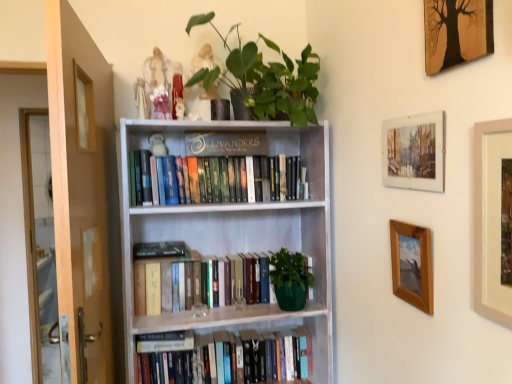
Describe the element at coordinates (490, 220) in the screenshot. I see `beige matte picture frame at upper right, the 2th picture frame from the bottom` at that location.

What do you see at coordinates (456, 32) in the screenshot? The width and height of the screenshot is (512, 384). I see `wooden framed tree art at upper right, marked as the 1th picture frame in a top-to-bottom arrangement` at bounding box center [456, 32].

The image size is (512, 384). Identify the location of watercolor paper picture frame at upper right, marked as the third picture frame in a bottom-to-top arrangement. (414, 152).

What are the coordinates of `beige matte picture frame at upper right, the 2th picture frame from the bottom` in the screenshot? It's located at (490, 220).

Between hardcover books at center, which appears as the 1th book when ordered from the bottom, and brown wooden screen door at left, which one appears on the left side from the viewer's perspective?

brown wooden screen door at left is more to the left.

Is hardcover books at center, which appears as the 1th book when ordered from the bottom, wider than brown wooden screen door at left?

Yes.

Is hardcover books at center, which appears as the 1th book when ordered from the bottom, not inside brown wooden screen door at left?

Yes, hardcover books at center, which appears as the 1th book when ordered from the bottom, is outside of brown wooden screen door at left.

Who is bigger, hardcover books at center, the third book viewed from the top, or brown wooden screen door at left?

brown wooden screen door at left is bigger.

From the image's perspective, which one is positioned higher, wooden framed tree art at upper right, marked as the 1th picture frame in a top-to-bottom arrangement, or watercolor paper picture frame at upper right, marked as the third picture frame in a bottom-to-top arrangement?

wooden framed tree art at upper right, marked as the 1th picture frame in a top-to-bottom arrangement.

Is point (457, 27) farther from camera compared to point (412, 135)?

No, it is in front of (412, 135).

Where is `the 2nd picture frame counting from the left of the wooden framed tree art at upper right, marked as the 1th picture frame in a top-to-bottom arrangement`? The image size is (512, 384). the 2nd picture frame counting from the left of the wooden framed tree art at upper right, marked as the 1th picture frame in a top-to-bottom arrangement is located at coordinates (414, 152).

Is wooden framed tree art at upper right, which is counted as the 4th picture frame, starting from the bottom, in front of or behind watercolor paper picture frame at upper right, marked as the third picture frame in a bottom-to-top arrangement, in the image?

Visually, wooden framed tree art at upper right, which is counted as the 4th picture frame, starting from the bottom, is located in front of watercolor paper picture frame at upper right, marked as the third picture frame in a bottom-to-top arrangement.

Is brown wooden screen door at left located within green matte plant at upper center?

No, brown wooden screen door at left is not a part of green matte plant at upper center.

Considering the relative sizes of green matte plant at upper center and brown wooden screen door at left in the image provided, is green matte plant at upper center wider than brown wooden screen door at left?

Correct, the width of green matte plant at upper center exceeds that of brown wooden screen door at left.

From the image's perspective, is green matte plant at upper center located above brown wooden screen door at left?

Yes.

Is point (280, 71) farther from viewer compared to point (76, 313)?

That is True.

In the scene shown: How different are the orientations of brown wooden screen door at left and wooden framed tree art at upper right, marked as the 1th picture frame in a top-to-bottom arrangement, in degrees?

brown wooden screen door at left and wooden framed tree art at upper right, marked as the 1th picture frame in a top-to-bottom arrangement, are facing 0.00462 degrees away from each other.

From the image's perspective, which is above, brown wooden screen door at left or wooden framed tree art at upper right, marked as the 1th picture frame in a top-to-bottom arrangement?

wooden framed tree art at upper right, marked as the 1th picture frame in a top-to-bottom arrangement, appears higher in the image.

From a real-world perspective, who is located lower, brown wooden screen door at left or wooden framed tree art at upper right, which is counted as the 4th picture frame, starting from the bottom?

brown wooden screen door at left is physically lower.

Considering the relative sizes of wooden picture frame at right, which is the fourth picture frame in top-to-bottom order, and hardcover books at center, marked as the 2th book in a bottom-to-top arrangement, in the image provided, is wooden picture frame at right, which is the fourth picture frame in top-to-bottom order, shorter than hardcover books at center, marked as the 2th book in a bottom-to-top arrangement,?

No.

Who is bigger, wooden picture frame at right, which ranks as the 1th picture frame in bottom-to-top order, or hardcover books at center, marked as the 2th book in a bottom-to-top arrangement?

With larger size is hardcover books at center, marked as the 2th book in a bottom-to-top arrangement.

From the picture: Which is correct: wooden picture frame at right, which is the fourth picture frame in top-to-bottom order, is inside hardcover books at center, the 2th book when ordered from top to bottom, or outside of it?

wooden picture frame at right, which is the fourth picture frame in top-to-bottom order, exists outside the volume of hardcover books at center, the 2th book when ordered from top to bottom.

Which is more to the right, wooden picture frame at right, which is the fourth picture frame in top-to-bottom order, or hardcover books at center, marked as the 2th book in a bottom-to-top arrangement?

wooden picture frame at right, which is the fourth picture frame in top-to-bottom order, is more to the right.

In the scene shown: Can you confirm if brown wooden screen door at left is shorter than green matte plant at upper center?

No, brown wooden screen door at left is not shorter than green matte plant at upper center.

Is point (62, 42) in front of point (309, 86)?

Yes, point (62, 42) is closer to viewer.

From the image's perspective, is brown wooden screen door at left positioned above or below green matte plant at upper center?

Based on their image positions, brown wooden screen door at left is located beneath green matte plant at upper center.

Is hardcover books at center, the 2th book when ordered from top to bottom, bigger or smaller than watercolor paper picture frame at upper right, the second picture frame positioned from the top?

Clearly, hardcover books at center, the 2th book when ordered from top to bottom, is larger in size than watercolor paper picture frame at upper right, the second picture frame positioned from the top.

Considering the sizes of objects hardcover books at center, the 2th book when ordered from top to bottom, and watercolor paper picture frame at upper right, marked as the third picture frame in a bottom-to-top arrangement, in the image provided, who is taller, hardcover books at center, the 2th book when ordered from top to bottom, or watercolor paper picture frame at upper right, marked as the third picture frame in a bottom-to-top arrangement,?

Standing taller between the two is watercolor paper picture frame at upper right, marked as the third picture frame in a bottom-to-top arrangement.

From a real-world perspective, which book is the 2nd one underneath the watercolor paper picture frame at upper right, marked as the third picture frame in a bottom-to-top arrangement? Please provide its 2D coordinates.

[(168, 278)]

Is hardcover books at center, the 2th book when ordered from top to bottom, at the right side of watercolor paper picture frame at upper right, marked as the third picture frame in a bottom-to-top arrangement?

Incorrect, hardcover books at center, the 2th book when ordered from top to bottom, is not on the right side of watercolor paper picture frame at upper right, marked as the third picture frame in a bottom-to-top arrangement.

Locate an element on the screen. screen door above the hardcover books at center, which appears as the 1th book when ordered from the bottom (from the image's perspective) is located at coordinates (84, 200).

There is a wooden framed tree art at upper right, marked as the 1th picture frame in a top-to-bottom arrangement. At what (x,y) coordinates should I click in order to perform the action: click on the 1st picture frame below it (from the image's perspective). Please return your answer as a coordinate pair (x, y). The image size is (512, 384). Looking at the image, I should click on (414, 152).

Considering their positions, is wooden picture frame at right, which is the fourth picture frame in top-to-bottom order, positioned further to green matte plant at upper center than hardcover books at center, which appears as the 1th book when ordered from the bottom?

hardcover books at center, which appears as the 1th book when ordered from the bottom, lies further to green matte plant at upper center than the other object.

Looking at the image, which one is located further to hardcover books at center, marked as the 2th book in a bottom-to-top arrangement, brown wooden screen door at left or beige matte picture frame at upper right, the 2th picture frame from the bottom?

The object further to hardcover books at center, marked as the 2th book in a bottom-to-top arrangement, is beige matte picture frame at upper right, the 2th picture frame from the bottom.

Considering their positions, is hardcover books at center, which appears as the 1th book when ordered from the bottom, positioned further to white wooden bookcase at center than green matte plant at upper center?

Based on the image, green matte plant at upper center appears to be further to white wooden bookcase at center.

Estimate the real-world distances between objects in this image. Which object is closer to wooden picture frame at right, which ranks as the 1th picture frame in bottom-to-top order, green matte plant at upper center or hardcover books at upper center, arranged as the 3th book when ordered from the bottom?

hardcover books at upper center, arranged as the 3th book when ordered from the bottom, is positioned closer to the anchor wooden picture frame at right, which ranks as the 1th picture frame in bottom-to-top order.

From the picture: When comparing their distances from brown wooden screen door at left, does hardcover books at center, marked as the 2th book in a bottom-to-top arrangement, or wooden framed tree art at upper right, marked as the 1th picture frame in a top-to-bottom arrangement, seem further?

Among the two, wooden framed tree art at upper right, marked as the 1th picture frame in a top-to-bottom arrangement, is located further to brown wooden screen door at left.

Considering their positions, is white wooden bookcase at center positioned further to hardcover books at center, which appears as the 1th book when ordered from the bottom, than beige matte picture frame at upper right, the third picture frame in the top-to-bottom sequence?

beige matte picture frame at upper right, the third picture frame in the top-to-bottom sequence, is further to hardcover books at center, which appears as the 1th book when ordered from the bottom.

Estimate the real-world distances between objects in this image. Which object is closer to white wooden bookcase at center, wooden framed tree art at upper right, marked as the 1th picture frame in a top-to-bottom arrangement, or hardcover books at center, the third book viewed from the top?

hardcover books at center, the third book viewed from the top, is closer to white wooden bookcase at center.

Considering their positions, is white wooden bookcase at center positioned closer to wooden framed tree art at upper right, marked as the 1th picture frame in a top-to-bottom arrangement, than hardcover books at center, marked as the 2th book in a bottom-to-top arrangement?

white wooden bookcase at center lies closer to wooden framed tree art at upper right, marked as the 1th picture frame in a top-to-bottom arrangement, than the other object.

Find the location of a particular element. bookcase between beige matte picture frame at upper right, the 2th picture frame from the bottom, and hardcover books at upper center, arranged as the 3th book when ordered from the bottom, in the front-back direction is located at coordinates (236, 234).

This screenshot has width=512, height=384. What are the coordinates of `bookcase between brown wooden screen door at left and beige matte picture frame at upper right, the third picture frame in the top-to-bottom sequence, in the horizontal direction` in the screenshot? It's located at (236, 234).

Where is `bookcase that lies between wooden framed tree art at upper right, marked as the 1th picture frame in a top-to-bottom arrangement, and hardcover books at center, the 2th book when ordered from top to bottom, from top to bottom`? bookcase that lies between wooden framed tree art at upper right, marked as the 1th picture frame in a top-to-bottom arrangement, and hardcover books at center, the 2th book when ordered from top to bottom, from top to bottom is located at coordinates (236, 234).

Identify the location of houseplant between brown wooden screen door at left and hardcover books at upper center, arranged as the 3th book when ordered from the bottom, in the front-back direction. (264, 78).